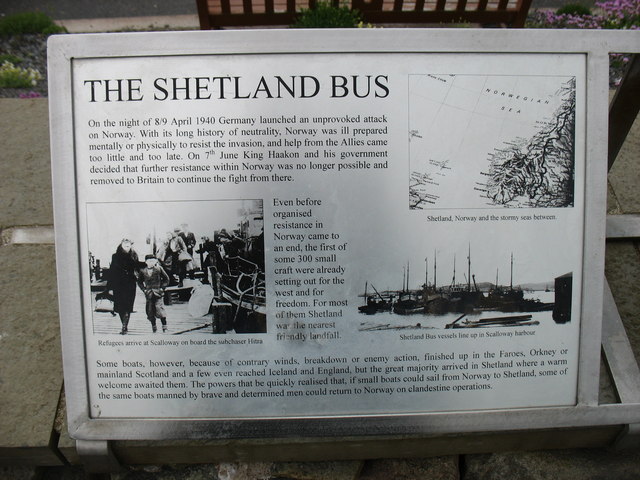
The width and height of the screenshot is (640, 480). I want to click on floor, so click(17, 304).